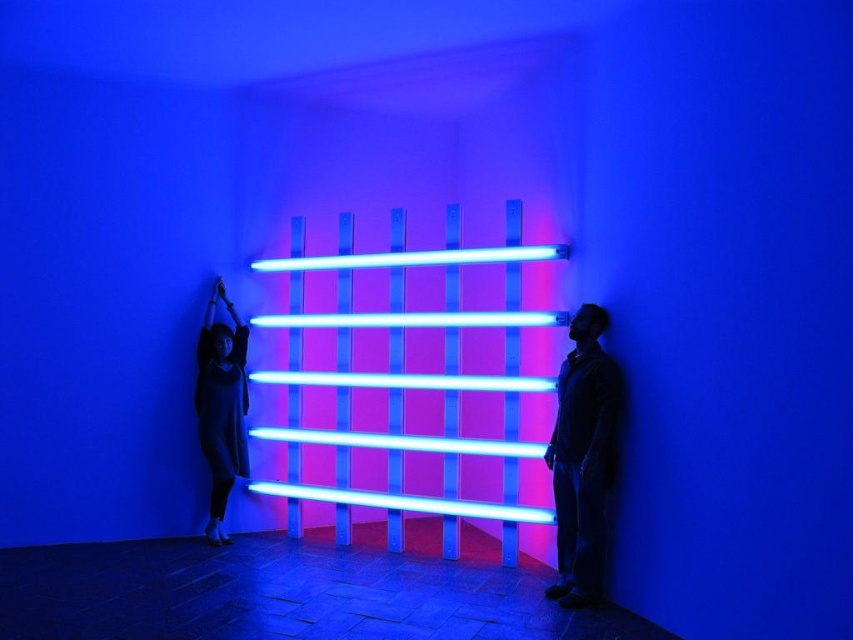
Question: Which object appears closest to the camera in this image?

Choices:
 (A) matte black shirt at right
 (B) matte black dress at left

Answer: (A)

Question: Is the position of matte black shirt at right less distant than that of matte black dress at left?

Choices:
 (A) no
 (B) yes

Answer: (B)

Question: Is matte black shirt at right in front of matte black dress at left?

Choices:
 (A) no
 (B) yes

Answer: (B)

Question: Which object appears farthest from the camera in this image?

Choices:
 (A) matte black shirt at right
 (B) matte black dress at left

Answer: (B)

Question: Is the position of matte black shirt at right more distant than that of matte black dress at left?

Choices:
 (A) no
 (B) yes

Answer: (A)

Question: Among these points, which one is nearest to the camera?

Choices:
 (A) (216, 348)
 (B) (560, 477)

Answer: (B)